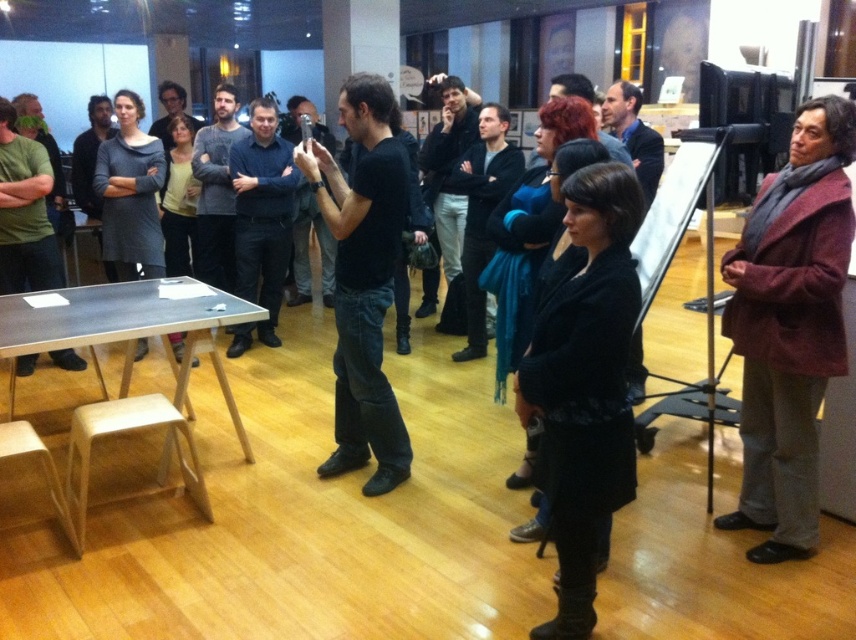
You are standing at the origin of the coordinate system in the room. You want to walk to the black matte coat at center located at point (586,387). Is there any object between you and the black matte coat at center that you need to avoid?

There is no object between you and the black matte coat at center at point (586,387), so you can walk straight to it without needing to avoid any obstacles.

You are a delivery robot with a width of 1.5 meters. You need to move from the wooden stool at lower left to the black matte coat at center. Can you navigate the space between them without turning sideways?

The distance between the black matte coat at center and wooden stool at lower left is 1.72 meters. Since the robot is 1.5 meters wide, it can fit through the space as the distance is greater than its width.